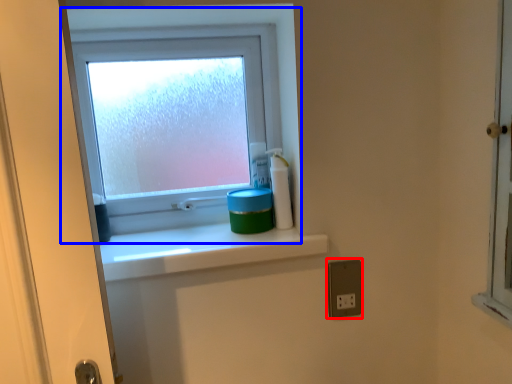
Question: Which of the following is the farthest to the observer, electric outlet (highlighted by a red box) or window (highlighted by a blue box)?

Choices:
 (A) electric outlet
 (B) window

Answer: (B)